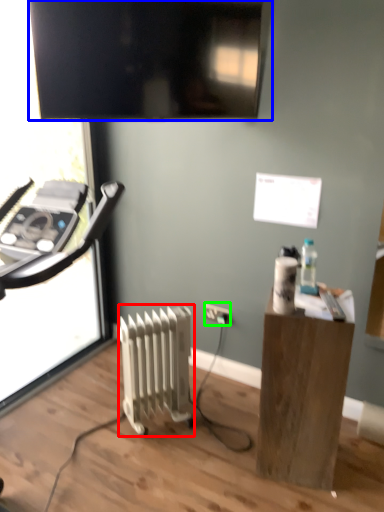
Question: Estimate the real-world distances between objects in this image. Which object is farther from radiator (highlighted by a red box), television (highlighted by a blue box) or electric outlet (highlighted by a green box)?

Choices:
 (A) television
 (B) electric outlet

Answer: (A)